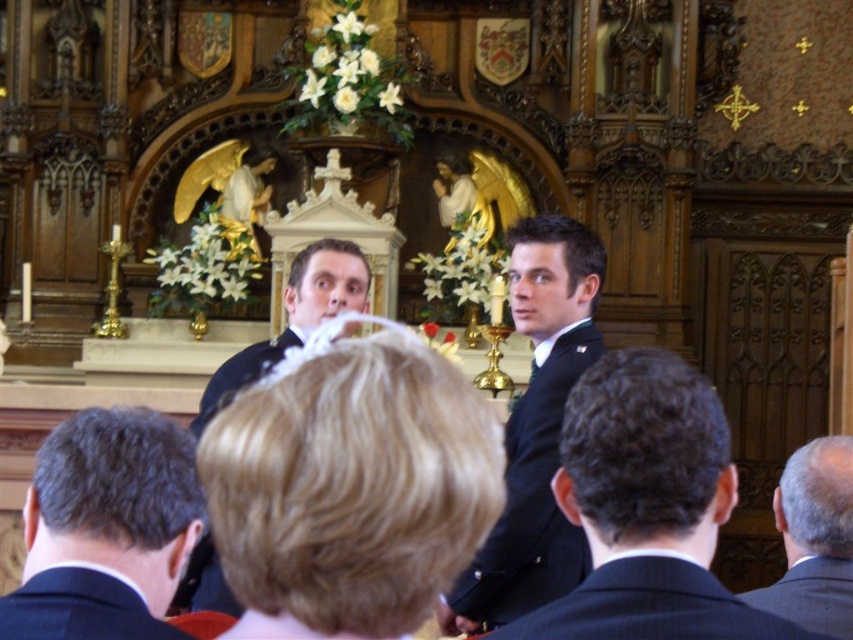
You are attending this event and want to greet the person in the dark blue uniform at center. Which direction should you move to approach them from your current position near the dark brown hair at lower left?

To approach the dark blue uniform at center from the dark brown hair at lower left, you should move to the right, as the dark brown hair at lower left is positioned on the left side of the dark blue uniform at center.